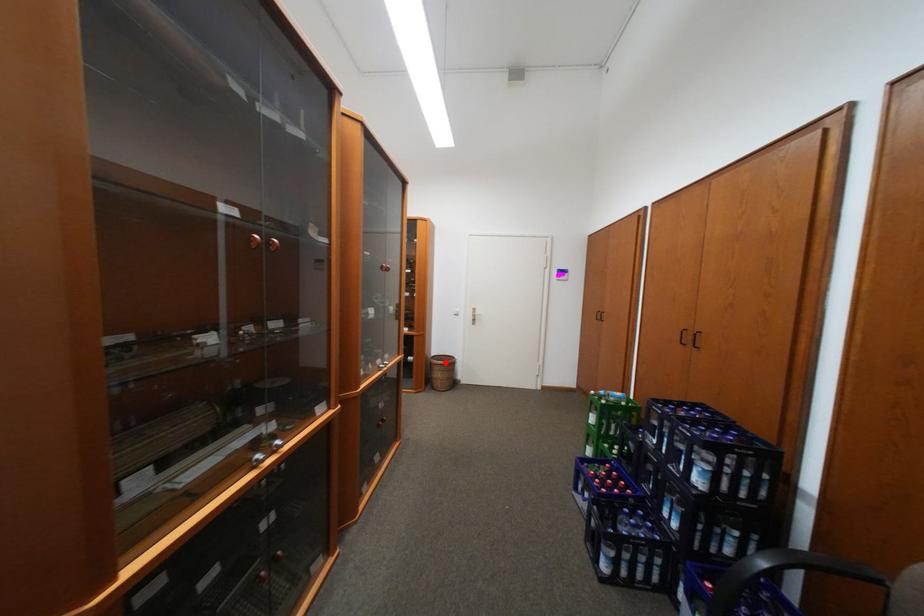
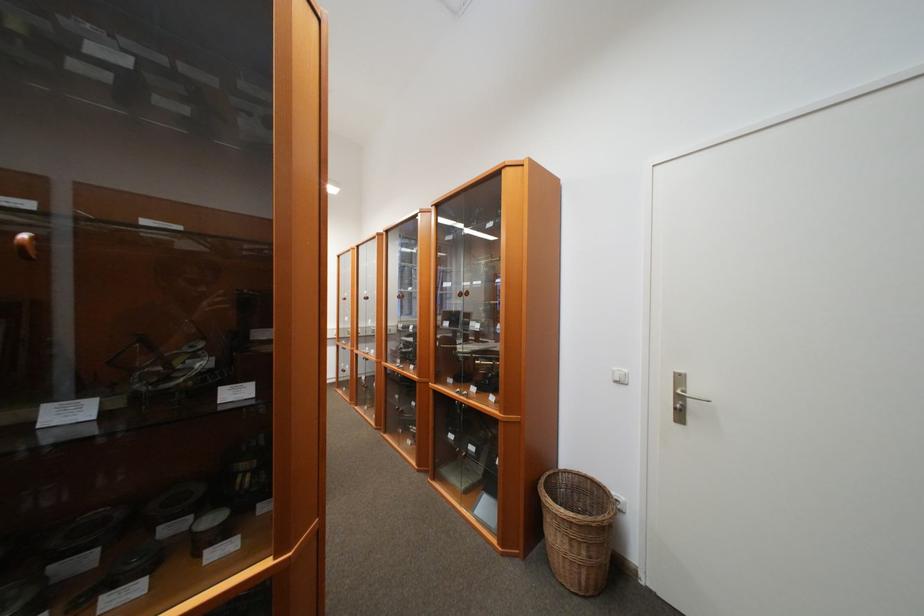
In the second image, find the point that corresponds to the highlighted location in the first image.

(560, 501)